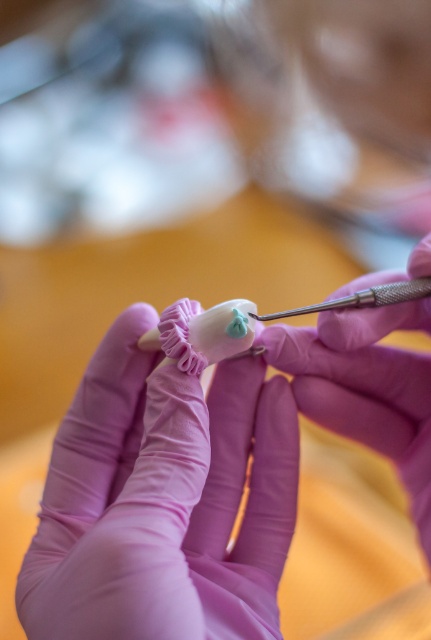
Between matte pink glove at center and purple rubber glove at center, which one appears on the right side from the viewer's perspective?

From the viewer's perspective, purple rubber glove at center appears more on the right side.

Which is behind, point (215, 560) or point (231, 336)?

The point (215, 560) is more distant.

Find the location of `matte pink glove at center`. matte pink glove at center is located at coordinates (162, 500).

Does matte pink glove at center appear on the right side of metallic needle at center?

No, matte pink glove at center is not to the right of metallic needle at center.

Looking at this image, is matte pink glove at center to the left of metallic needle at center from the viewer's perspective?

Correct, you'll find matte pink glove at center to the left of metallic needle at center.

In the scene shown: Who is more distant from viewer, (72, 538) or (399, 289)?

Positioned behind is point (399, 289).

This screenshot has height=640, width=431. Identify the location of matte pink glove at center. (162, 500).

Who is more forward, (174, 332) or (308, 308)?

Point (174, 332) is in front.

Does purple rubber glove at center appear on the left side of metallic needle at center?

Yes, purple rubber glove at center is to the left of metallic needle at center.

Locate an element on the screen. purple rubber glove at center is located at coordinates (205, 332).